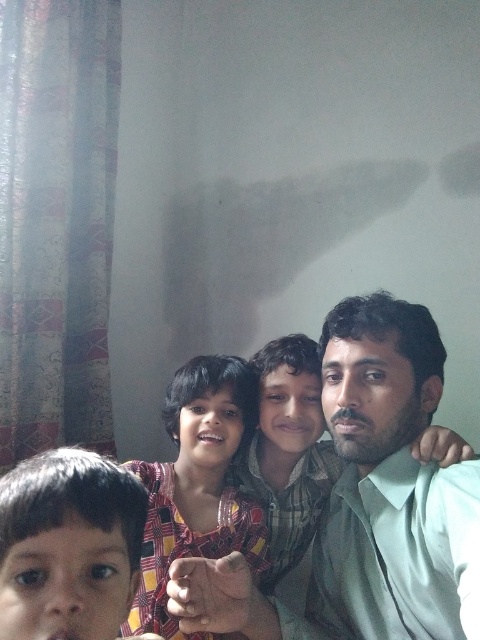
You are a photographer positioned in front of the group. You need to capture a closeup shot of both the matte green shirt at center and the smooth brown hair at lower left. Given that your camera can only focus on objects within a 50 cm range, will you be able to capture both subjects in focus?

The matte green shirt at center and the smooth brown hair at lower left are 49.19 centimeters apart from each other, so yes, the camera can focus on both subjects since the distance between them is within the 50 cm range.

You are a photographer trying to capture a candid shot of the matte green shirt at center and smooth brown hair at lower left. Which object should you focus on first if you want to capture both in a single frame without moving the camera?

The smooth brown hair at lower left should be focused on first since it is positioned higher than the matte green shirt at center, allowing the photographer to adjust the framing to include both without moving the camera.

You are a photographer setting up for a family portrait. You need to ensure that the smooth brown hair at lower left and the light green shirt at center are within a 50 cm distance to frame them properly. Based on the scene description, can you confirm if they are within the required distance?

The smooth brown hair at lower left is 45.24 centimeters from the light green shirt at center, which is within the 50 cm requirement. Therefore, they can be framed properly.